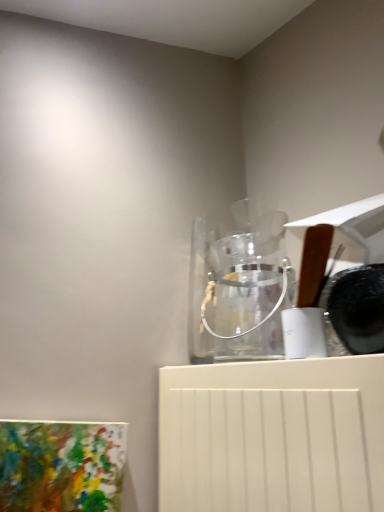
Describe the element at coordinates (247, 296) in the screenshot. Image resolution: width=384 pixels, height=512 pixels. I see `transparent glass jar at upper center` at that location.

At what (x,y) coordinates should I click in order to perform the action: click on transparent glass jar at upper center. Please return your answer as a coordinate pair (x, y). Image resolution: width=384 pixels, height=512 pixels. Looking at the image, I should click on (247, 296).

At what (x,y) coordinates should I click in order to perform the action: click on transparent glass jar at upper center. Please return your answer as a coordinate pair (x, y). Looking at the image, I should click on (247, 296).